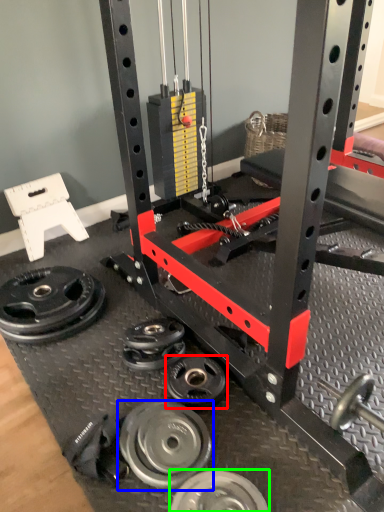
Question: Estimate the real-world distances between objects in this image. Which object is closer to wheel (highlighted by a red box), wheel (highlighted by a blue box) or wheel (highlighted by a green box)?

Choices:
 (A) wheel
 (B) wheel

Answer: (A)